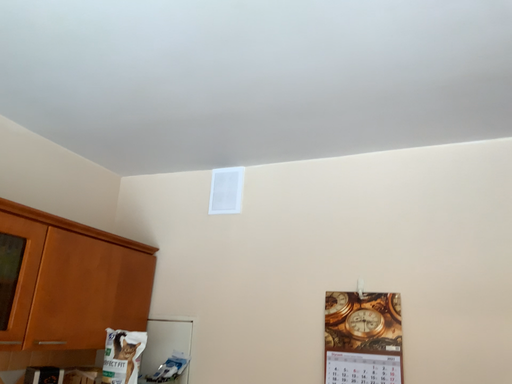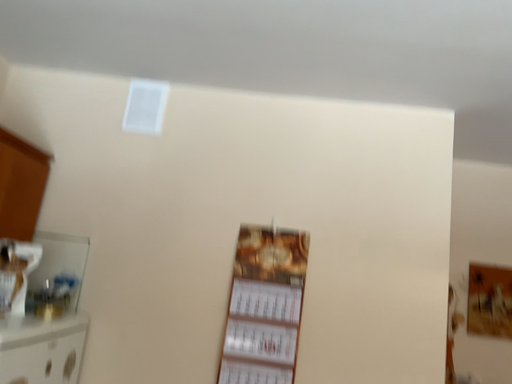
Question: How did the camera likely rotate when shooting the video?

Choices:
 (A) rotated downward
 (B) rotated upward

Answer: (A)